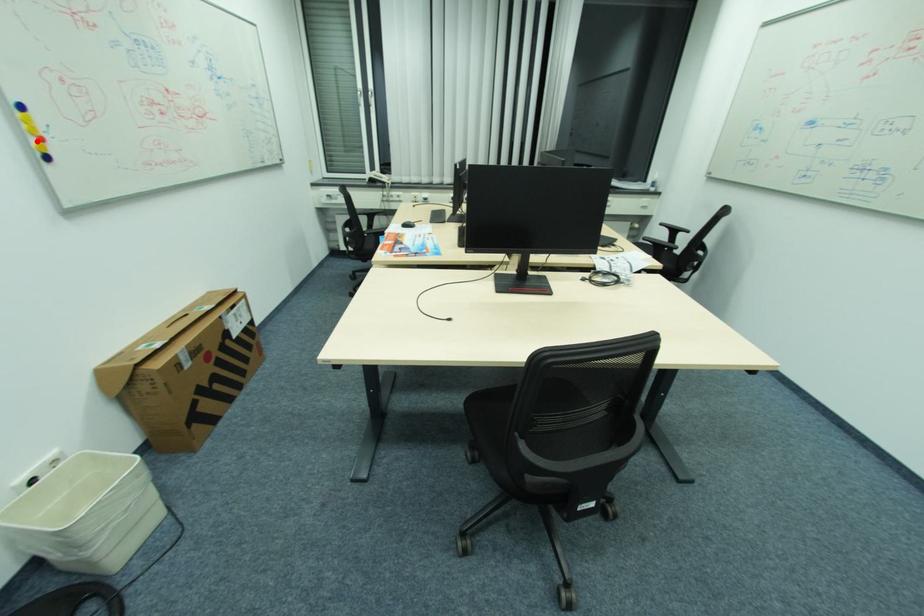
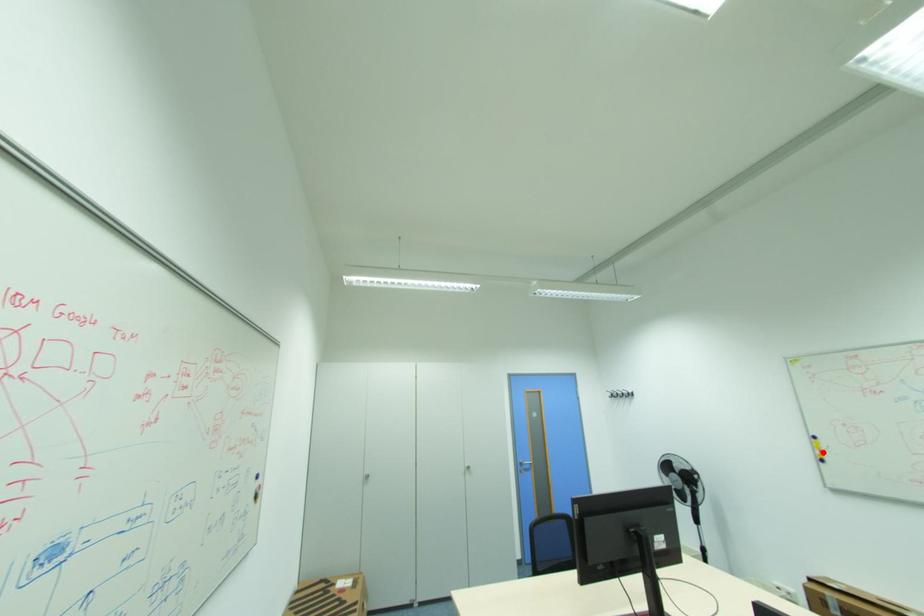
I am providing you with two images of the same scene from different viewpoints. A red point is marked on the first image and another point is marked on the second image. Are the points marked in image1 and image2 representing the same 3D position?

Yes